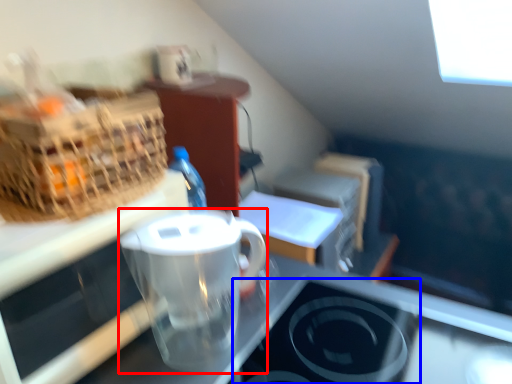
Question: Among these objects, which one is nearest to the camera, coffee cup (highlighted by a red box) or appliance (highlighted by a blue box)?

Choices:
 (A) coffee cup
 (B) appliance

Answer: (B)